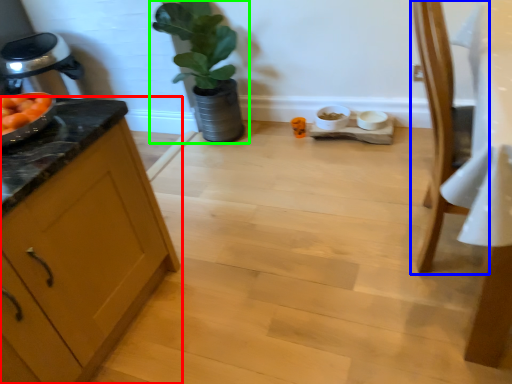
Question: Based on their relative distances, which object is farther from cabinetry (highlighted by a red box)? Choose from chair (highlighted by a blue box) and houseplant (highlighted by a green box).

Choices:
 (A) chair
 (B) houseplant

Answer: (B)